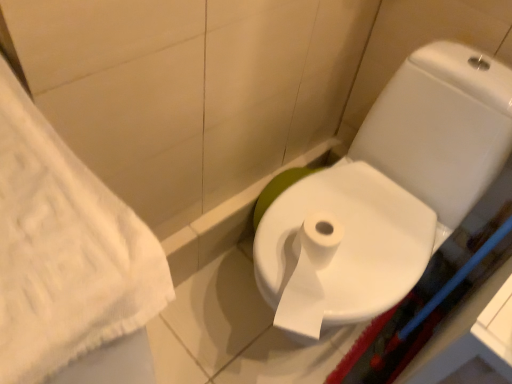
The width and height of the screenshot is (512, 384). What do you see at coordinates (387, 192) in the screenshot?
I see `white glossy toilet at center` at bounding box center [387, 192].

The height and width of the screenshot is (384, 512). In order to click on white paper bidet at center in this screenshot , I will do point(340,248).

You are a GUI agent. You are given a task and a screenshot of the screen. Output one action in this format:
    pyautogui.click(x=<x>, y=<y>)
    Task: Click on the toilet beneath the white textured towel at left (from a real-world perspective)
    
    Given the screenshot: What is the action you would take?
    pyautogui.click(x=387, y=192)

Is white textured towel at left at the back of white glossy toilet at center?

That's not correct — white glossy toilet at center is not looking away from white textured towel at left.

Does white glossy toilet at center have a lesser height compared to white textured towel at left?

Correct, white glossy toilet at center is not as tall as white textured towel at left.

Based on the photo, are white glossy toilet at center and white textured towel at left far apart?

white glossy toilet at center is near white textured towel at left, not far away.

Does white textured towel at left contain white glossy toilet at center?

No, white glossy toilet at center is not inside white textured towel at left.

Is white glossy toilet at center at the back of white textured towel at left?

No, white textured towel at left is not facing away from white glossy toilet at center.

Which is closer to the camera, [151,380] or [328,238]?

The point [151,380] is in front.

Do you think white paper bidet at center is within white textured towel at left, or outside of it?

white paper bidet at center is not enclosed by white textured towel at left.

Between white paper bidet at center and white textured towel at left, which one is positioned in front?

white textured towel at left is closer to the camera.

From the image's perspective, is white paper bidet at center over white textured towel at left?

Correct, white paper bidet at center appears higher than white textured towel at left in the image.

Are white paper bidet at center and white textured towel at left located far from each other?

white paper bidet at center is actually quite close to white textured towel at left.

Would you say white paper bidet at center is inside or outside white glossy toilet at center?

white paper bidet at center lies within the bounds of white glossy toilet at center.

Locate an element on the screen. This screenshot has width=512, height=384. toilet lying above the white paper bidet at center (from the image's perspective) is located at coordinates (387, 192).

Could you tell me if white paper bidet at center is turned towards white glossy toilet at center?

Yes, white paper bidet at center is aimed at white glossy toilet at center.

Is white textured towel at left looking in the opposite direction of white paper bidet at center?

white textured towel at left is not turned away from white paper bidet at center.

Is white paper bidet at center inside white textured towel at left?

Definitely not — white paper bidet at center is not inside white textured towel at left.

Would you say white textured towel at left is to the left or to the right of white paper bidet at center in the picture?

Based on their positions, white textured towel at left is located to the left of white paper bidet at center.

How different are the orientations of white textured towel at left and white paper bidet at center in degrees?

The angle between the facing direction of white textured towel at left and the facing direction of white paper bidet at center is 178 degrees.

Is white glossy toilet at center outside of white paper bidet at center?

Yes, white glossy toilet at center is outside of white paper bidet at center.

Which of these two, white glossy toilet at center or white paper bidet at center, is smaller?

With smaller size is white paper bidet at center.

Between white glossy toilet at center and white paper bidet at center, which one is positioned in front?

white glossy toilet at center.

I want to click on toilet to the right of white textured towel at left, so click(387, 192).

Find the location of a particular element. This screenshot has width=512, height=384. bath towel located below the white glossy toilet at center (from the image's perspective) is located at coordinates (69, 261).

From the image, which object appears to be nearer to white glossy toilet at center, white textured towel at left or white paper bidet at center?

The object closer to white glossy toilet at center is white paper bidet at center.

Looking at the image, which one is located closer to white paper bidet at center, white glossy toilet at center or white textured towel at left?

Based on the image, white glossy toilet at center appears to be nearer to white paper bidet at center.

When comparing their distances from white paper bidet at center, does white textured towel at left or white glossy toilet at center seem further?

Among the two, white textured towel at left is located further to white paper bidet at center.

Considering their positions, is white paper bidet at center positioned closer to white textured towel at left than white glossy toilet at center?

Among the two, white paper bidet at center is located nearer to white textured towel at left.

Looking at the image, which one is located closer to white glossy toilet at center, white paper bidet at center or white textured towel at left?

white paper bidet at center.

Looking at the image, which one is located further to white textured towel at left, white glossy toilet at center or white paper bidet at center?

white glossy toilet at center lies further to white textured towel at left than the other object.

You are a GUI agent. You are given a task and a screenshot of the screen. Output one action in this format:
    pyautogui.click(x=<x>, y=<y>)
    Task: Click on the bidet located between white textured towel at left and white glossy toilet at center in the left-right direction
    
    Given the screenshot: What is the action you would take?
    pyautogui.click(x=340, y=248)